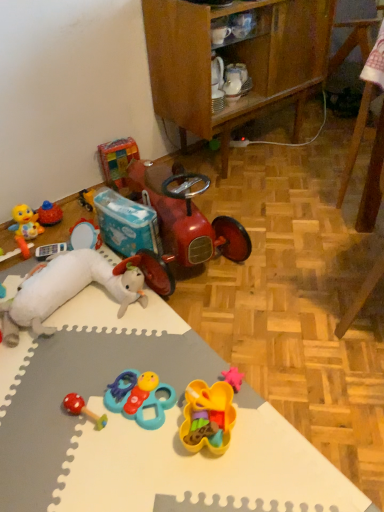
Image resolution: width=384 pixels, height=512 pixels. Identify the location of empty space that is to the right of white foam mat at lower left. (294, 318).